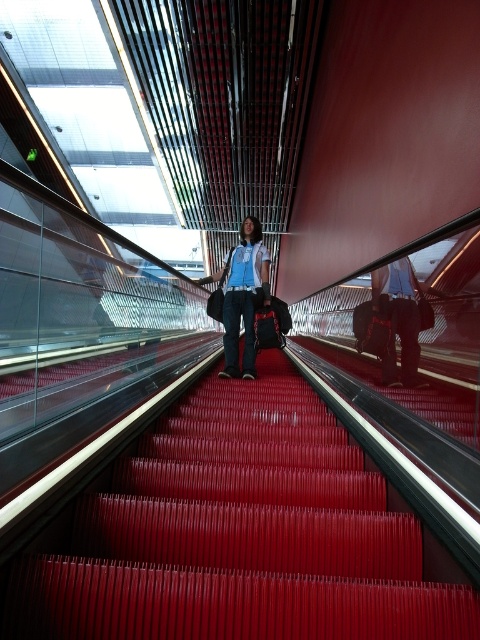
Question: Is red rubber stairs at center further to the viewer compared to matte black pants at center?

Choices:
 (A) yes
 (B) no

Answer: (B)

Question: Estimate the real-world distances between objects in this image. Which object is closer to the red rubber stairs at center?

Choices:
 (A) matte blue shirt at center
 (B) matte black pants at center

Answer: (B)

Question: Which object is closer to the camera taking this photo?

Choices:
 (A) red rubber stairs at center
 (B) matte black pants at center

Answer: (A)

Question: Considering the real-world distances, which object is farthest from the red rubber stairs at center?

Choices:
 (A) matte blue shirt at center
 (B) matte black pants at center

Answer: (A)

Question: Does red rubber stairs at center have a smaller size compared to matte black pants at center?

Choices:
 (A) no
 (B) yes

Answer: (A)

Question: Is matte blue shirt at center positioned at the back of matte black pants at center?

Choices:
 (A) no
 (B) yes

Answer: (B)